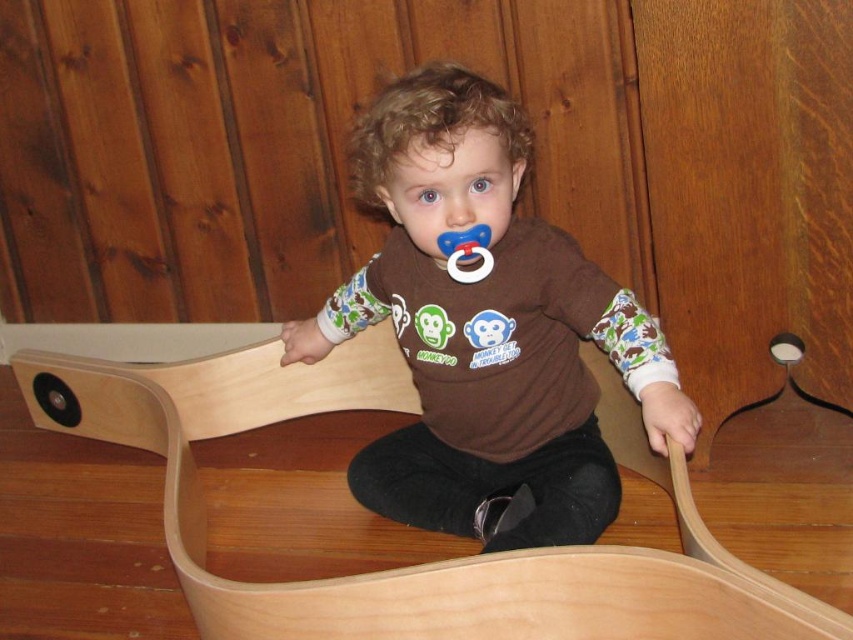
Question: Where is brown matte shirt at center located in relation to blue rubber pacifier at center in the image?

Choices:
 (A) right
 (B) left

Answer: (B)

Question: Is brown matte shirt at center thinner than blue rubber pacifier at center?

Choices:
 (A) yes
 (B) no

Answer: (B)

Question: Can you confirm if brown matte shirt at center is positioned above blue rubber pacifier at center?

Choices:
 (A) yes
 (B) no

Answer: (B)

Question: Which point is farther to the camera?

Choices:
 (A) (469, 253)
 (B) (503, 465)

Answer: (B)

Question: Which of the following is the farthest from the observer?

Choices:
 (A) (456, 499)
 (B) (488, 252)

Answer: (A)